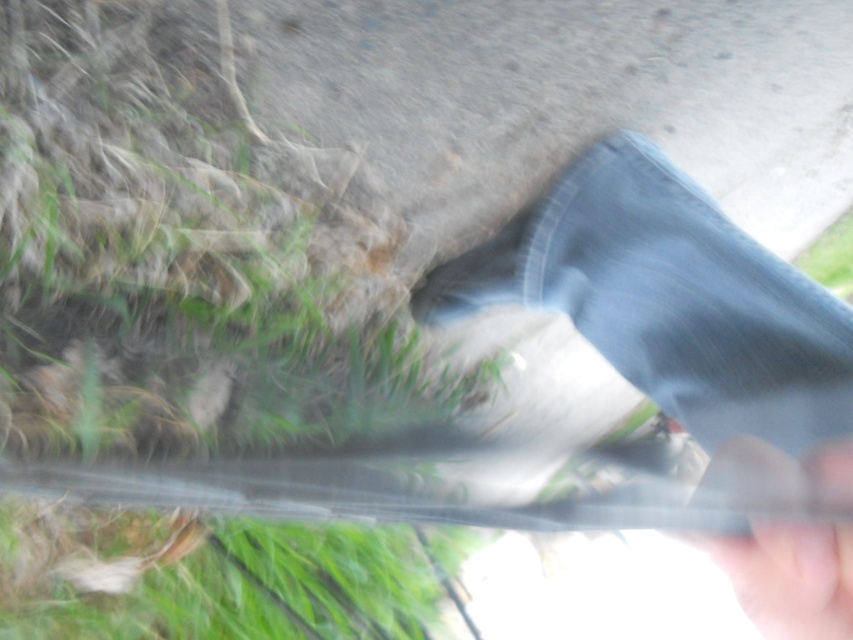
Question: Which object is the farthest from the smooth skin hand at lower right?

Choices:
 (A) denim pants at lower right
 (B) green grass at lower left
 (C) matte black shoe at lower center

Answer: (B)

Question: Among these objects, which one is nearest to the camera?

Choices:
 (A) denim pants at lower right
 (B) green grass at lower left

Answer: (A)

Question: Which point is closer to the camera taking this photo?

Choices:
 (A) (828, 592)
 (B) (457, 301)

Answer: (A)

Question: Can you confirm if denim pants at lower right is positioned to the right of smooth skin hand at lower right?

Choices:
 (A) no
 (B) yes

Answer: (A)

Question: Does denim pants at lower right appear over smooth skin hand at lower right?

Choices:
 (A) yes
 (B) no

Answer: (A)

Question: Is green grass at lower left to the right of matte black shoe at lower center from the viewer's perspective?

Choices:
 (A) yes
 (B) no

Answer: (B)